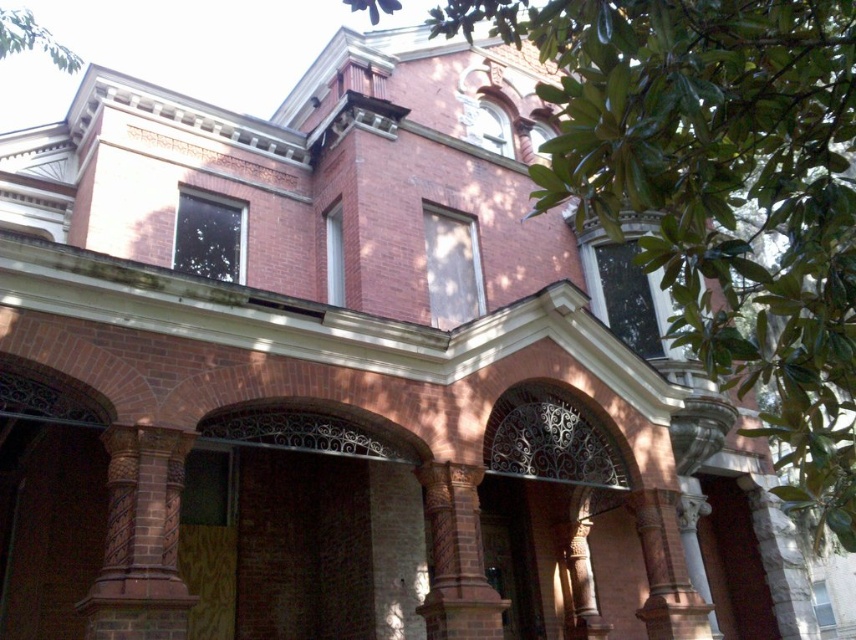
You are standing 1.7 meters tall and looking at the historic brick building. There is a point at coordinates point (134, 452). Can you reach this point with your hand?

The point (134, 452) is 10.40 meters away from the camera, which is much farther than the average arm length of a person. Therefore, you cannot reach it with your hand.

You are an architect examining the historic brick building. You notice two columns at the center of the building. One is labeled as brown stone column at center and the other as brown textured column at center. Which column has a larger size?

The brown stone column at center is bigger than the brown textured column at center, so the brown stone column at center has a larger size.

You are an architect planning to install a decorative banner between the brown stone column at center and the brown textured column at center. The banner is 5 meters long. Will the banner fit between them without needing to be stretched?

The distance between the brown stone column at center and the brown textured column at center is 4.70 meters. Since the banner is 5 meters long, it will need to be stretched to fit between them.